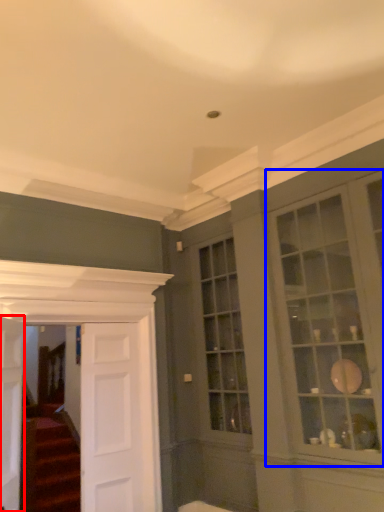
Question: Which point is closer to the camera, door (highlighted by a red box) or window (highlighted by a blue box)?

Choices:
 (A) door
 (B) window

Answer: (B)